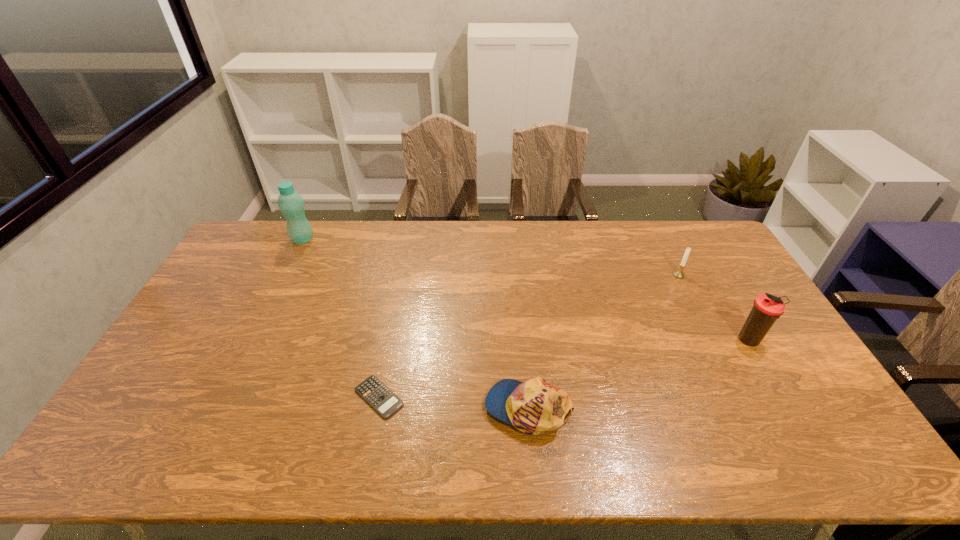
The image size is (960, 540). I want to click on free space at the far edge of the desktop, so (351, 245).

Locate an element on the screen. Image resolution: width=960 pixels, height=540 pixels. blank area at the near edge is located at coordinates (180, 449).

Find the location of a particular element. vacant space at the left edge of the desktop is located at coordinates tap(190, 343).

At what (x,y) coordinates should I click in order to perform the action: click on free space at the right edge. Please return your answer as a coordinate pair (x, y). Looking at the image, I should click on (700, 273).

Locate an element on the screen. This screenshot has height=540, width=960. vacant space at the far left corner of the desktop is located at coordinates (261, 222).

The width and height of the screenshot is (960, 540). In order to click on vacant space at the near left corner in this screenshot , I will do `click(166, 450)`.

This screenshot has height=540, width=960. Find the location of `free point between the bottle and the third farthest object`. free point between the bottle and the third farthest object is located at coordinates (526, 290).

Find the location of a particular element. free space between the shortest object and the fourth tallest object is located at coordinates (454, 402).

Image resolution: width=960 pixels, height=540 pixels. I want to click on free spot between the cap and the tallest object, so click(x=416, y=323).

The width and height of the screenshot is (960, 540). I want to click on free space between the farthest object and the third farthest object, so click(526, 290).